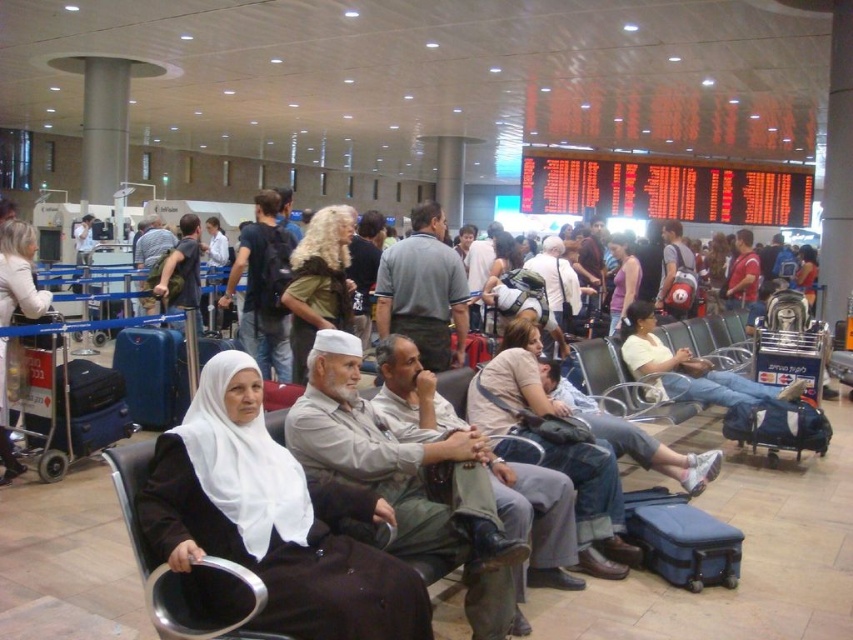
Is light brown leather pants at center bigger than black plastic chair at center?

Indeed, light brown leather pants at center has a larger size compared to black plastic chair at center.

The image size is (853, 640). I want to click on light brown leather pants at center, so click(x=393, y=472).

Where is `light brown leather pants at center`? This screenshot has width=853, height=640. light brown leather pants at center is located at coordinates (393, 472).

Identify the location of light brown leather pants at center. (393, 472).

Does point (323, 369) lie behind point (590, 342)?

No, (323, 369) is closer to viewer.

Who is more forward, (338, 369) or (601, 380)?

Positioned in front is point (338, 369).

Locate an element on the screen. This screenshot has height=640, width=853. light brown leather pants at center is located at coordinates (393, 472).

Where is `light brown leather pants at center`? This screenshot has height=640, width=853. light brown leather pants at center is located at coordinates (393, 472).

Which is more to the left, dark brown leather jacket at center or metallic gray chair at center?

From the viewer's perspective, dark brown leather jacket at center appears more on the left side.

Locate an element on the screen. dark brown leather jacket at center is located at coordinates (318, 282).